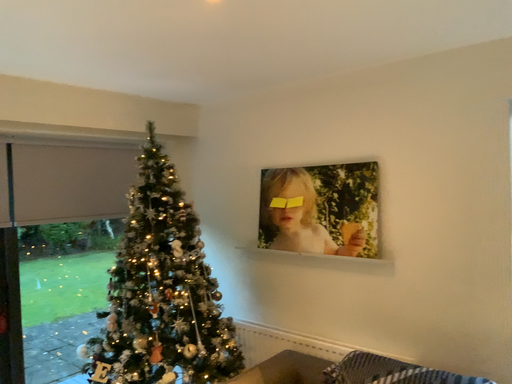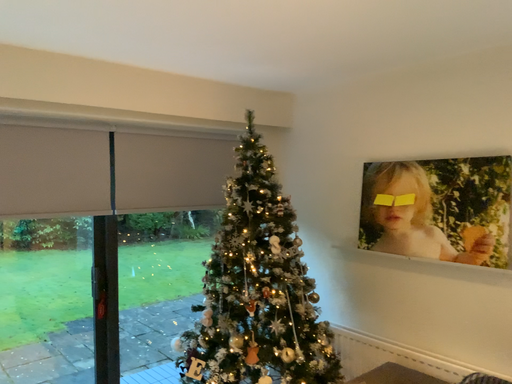
Question: Which way did the camera rotate in the video?

Choices:
 (A) rotated left
 (B) rotated right

Answer: (A)